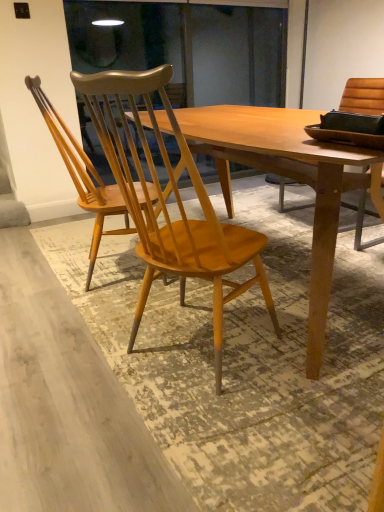
Locate an element on the screen. Image resolution: width=384 pixels, height=512 pixels. vacant area that lies to the right of light brown wood chair at center, the 2th chair when ordered from left to right is located at coordinates (302, 358).